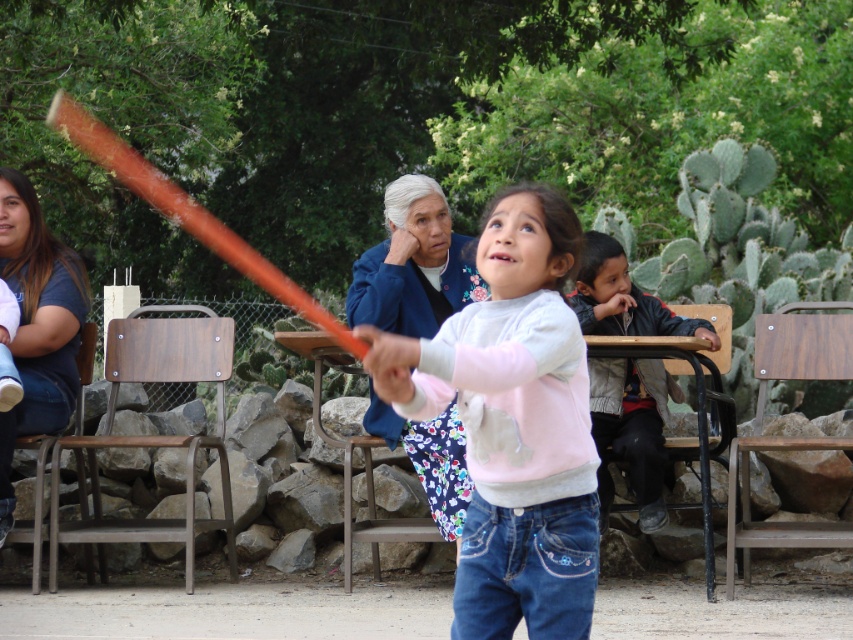
This screenshot has height=640, width=853. I want to click on matte pink sweater at center, so click(x=514, y=422).

Does point (546, 220) come closer to viewer compared to point (712, 349)?

Yes, point (546, 220) is closer to viewer.

What do you see at coordinates (514, 422) in the screenshot? This screenshot has height=640, width=853. I see `matte pink sweater at center` at bounding box center [514, 422].

Locate an element on the screen. This screenshot has height=640, width=853. matte pink sweater at center is located at coordinates (514, 422).

Does point (427, 406) come in front of point (451, 413)?

That is True.

Which is more to the left, matte pink sweater at center or blue floral dress at center?

blue floral dress at center

Who is more forward, (498,513) or (407,250)?

Point (498,513) is in front.

Locate an element on the screen. The image size is (853, 640). matte pink sweater at center is located at coordinates (514, 422).

Who is positioned more to the right, matte pink sweater at center or dark blue t-shirt at left?

From the viewer's perspective, matte pink sweater at center appears more on the right side.

Is matte pink sweater at center to the right of dark blue t-shirt at left from the viewer's perspective?

Indeed, matte pink sweater at center is positioned on the right side of dark blue t-shirt at left.

Which is in front, point (459, 312) or point (3, 529)?

Positioned in front is point (459, 312).

Where is `matte pink sweater at center`? Image resolution: width=853 pixels, height=640 pixels. matte pink sweater at center is located at coordinates (514, 422).